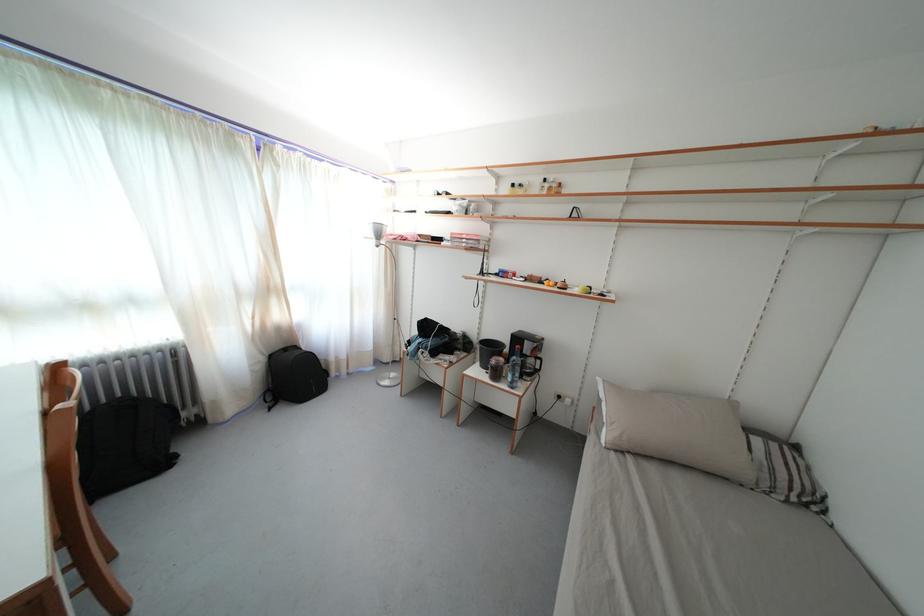
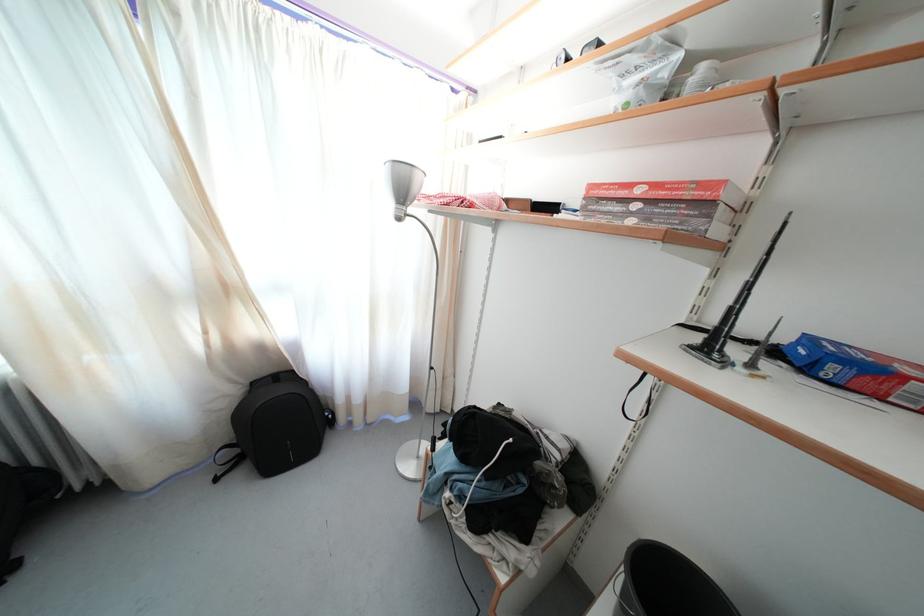
In the second image, find the point that corresponds to (x=384, y=241) in the first image.

(408, 199)